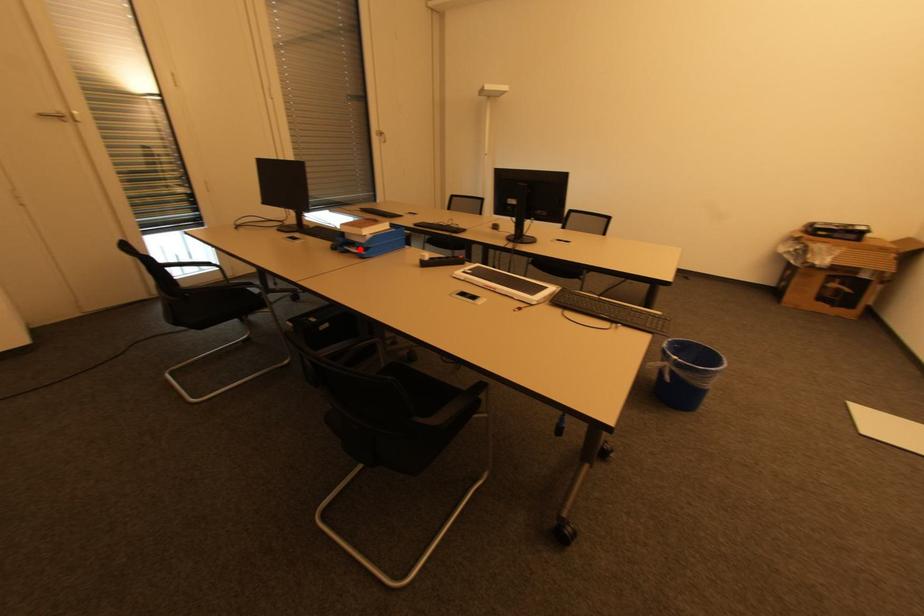
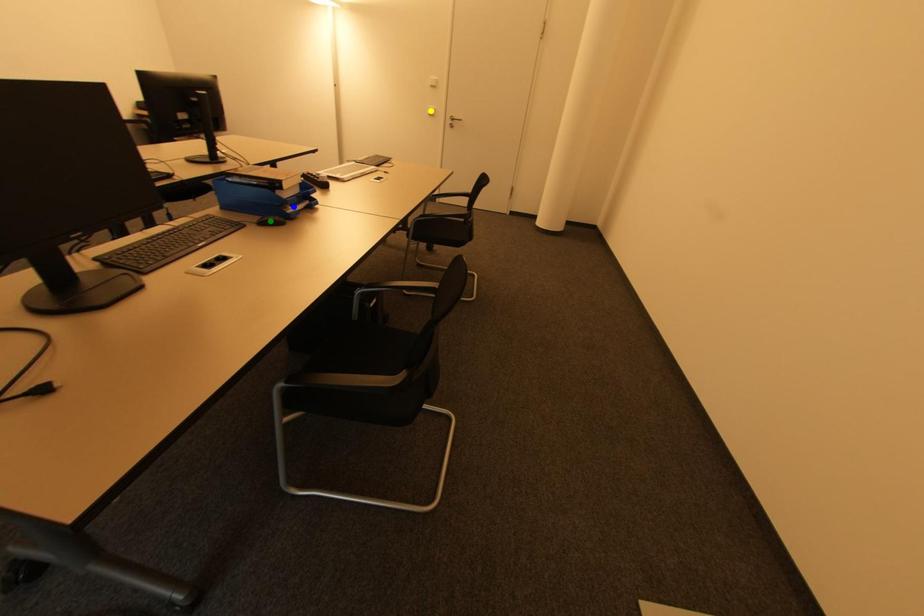
Question: I am providing you with two images of the same scene from different viewpoints. A red point is marked on the first image. You are given multiple points on the second image. Which spot in image 2 lines up with the point in image 1?

Choices:
 (A) yellow point
 (B) green point
 (C) blue point

Answer: (C)